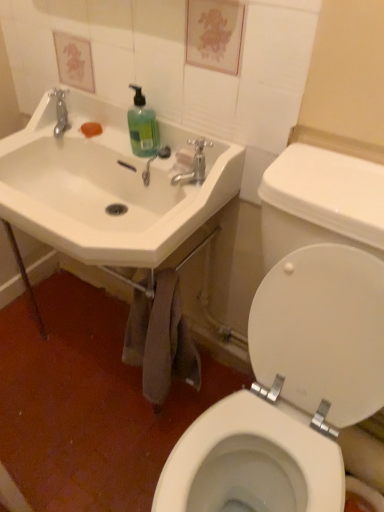
The width and height of the screenshot is (384, 512). I want to click on white ceramic sink at upper left, so [107, 187].

You are a GUI agent. You are given a task and a screenshot of the screen. Output one action in this format:
    pyautogui.click(x=<x>, y=<y>)
    Task: Click on the white glossy toilet lid at right
    The width and height of the screenshot is (384, 512).
    Given the screenshot: What is the action you would take?
    pyautogui.click(x=322, y=330)

Does point (197, 169) come behind point (166, 227)?

Yes.

Is matte silver faucet at upper center oriented towards white ceramic sink at upper left?

Yes, matte silver faucet at upper center is turned towards white ceramic sink at upper left.

Which of these two, matte silver faucet at upper center or white ceramic sink at upper left, is thinner?

Thinner between the two is matte silver faucet at upper center.

Is point (339, 325) farther from viewer compared to point (152, 160)?

No, (339, 325) is closer to viewer.

Considering the positions of objects white glossy toilet lid at right and translucent plastic faucet at upper center in the image provided, who is more to the left, white glossy toilet lid at right or translucent plastic faucet at upper center?

Positioned to the left is translucent plastic faucet at upper center.

Considering the sizes of objects white glossy toilet lid at right and translucent plastic faucet at upper center in the image provided, who is shorter, white glossy toilet lid at right or translucent plastic faucet at upper center?

Standing shorter between the two is translucent plastic faucet at upper center.

Is green matte liquid soap at upper center inside the boundaries of white glossy toilet lid at right, or outside?

green matte liquid soap at upper center lies outside white glossy toilet lid at right.

Does green matte liquid soap at upper center appear on the right side of white glossy toilet lid at right?

Incorrect, green matte liquid soap at upper center is not on the right side of white glossy toilet lid at right.

Is green matte liquid soap at upper center thinner than white glossy toilet lid at right?

No, green matte liquid soap at upper center is not thinner than white glossy toilet lid at right.

I want to click on cleaning product above the white glossy toilet lid at right (from a real-world perspective), so click(142, 126).

How far apart are white glossy toilet lid at right and matte silver faucet at upper center?

white glossy toilet lid at right and matte silver faucet at upper center are 18.10 inches apart.

Is white glossy toilet lid at right oriented away from matte silver faucet at upper center?

No, white glossy toilet lid at right's orientation is not away from matte silver faucet at upper center.

How many degrees apart are the facing directions of white glossy toilet lid at right and matte silver faucet at upper center?

The angular difference between white glossy toilet lid at right and matte silver faucet at upper center is 0.278 degrees.

Which object is positioned more to the left, white glossy toilet lid at right or matte silver faucet at upper center?

matte silver faucet at upper center.

Does white ceramic sink at upper left have a lesser width compared to matte silver faucet at upper center?

No, white ceramic sink at upper left is not thinner than matte silver faucet at upper center.

Would you say white ceramic sink at upper left is a long distance from matte silver faucet at upper center?

Actually, white ceramic sink at upper left and matte silver faucet at upper center are a little close together.

From the image's perspective, which is below, white ceramic sink at upper left or matte silver faucet at upper center?

From the image's view, white ceramic sink at upper left is below.

Which object is further away from the camera, white ceramic sink at upper left or green matte liquid soap at upper center?

green matte liquid soap at upper center is more distant.

Is white ceramic sink at upper left situated inside green matte liquid soap at upper center or outside?

white ceramic sink at upper left is located beyond the bounds of green matte liquid soap at upper center.

You are a GUI agent. You are given a task and a screenshot of the screen. Output one action in this format:
    pyautogui.click(x=<x>, y=<y>)
    Task: Click on the cleaning product located behind the white ceramic sink at upper left
    Image resolution: width=384 pixels, height=512 pixels.
    Given the screenshot: What is the action you would take?
    pyautogui.click(x=142, y=126)

From the image's perspective, is white ceramic sink at upper left on top of green matte liquid soap at upper center?

Incorrect, from the image's perspective, white ceramic sink at upper left is lower than green matte liquid soap at upper center.

Is green matte liquid soap at upper center a part of white glossy toilet lid at right?

No.

Considering the sizes of objects white glossy toilet lid at right and green matte liquid soap at upper center in the image provided, who is wider, white glossy toilet lid at right or green matte liquid soap at upper center?

green matte liquid soap at upper center is wider.

Could you tell me if white glossy toilet lid at right is turned towards green matte liquid soap at upper center?

No, white glossy toilet lid at right is not oriented towards green matte liquid soap at upper center.

Considering their positions, is white glossy toilet lid at right located in front of or behind green matte liquid soap at upper center?

Visually, white glossy toilet lid at right is located in front of green matte liquid soap at upper center.

There is a white ceramic sink at upper left. Where is `tap above it (from a real-world perspective)`? This screenshot has height=512, width=384. tap above it (from a real-world perspective) is located at coordinates (194, 163).

The width and height of the screenshot is (384, 512). I want to click on plumbing fixture that is above the white glossy toilet lid at right (from the image's perspective), so click(x=153, y=159).

Considering their positions, is green matte liquid soap at upper center positioned further to matte silver faucet at upper center than white ceramic sink at upper left?

white ceramic sink at upper left lies further to matte silver faucet at upper center than the other object.

Which object lies nearer to the anchor point white glossy toilet lid at right, white ceramic sink at upper left or green matte liquid soap at upper center?

white ceramic sink at upper left is positioned closer to the anchor white glossy toilet lid at right.

Which object lies nearer to the anchor point white ceramic sink at upper left, translucent plastic faucet at upper center or white glossy toilet lid at right?

translucent plastic faucet at upper center.

Based on their spatial positions, is matte silver faucet at upper center or translucent plastic faucet at upper center further from white ceramic sink at upper left?

matte silver faucet at upper center is positioned further to the anchor white ceramic sink at upper left.

Looking at this image, from the image, which object appears to be nearer to green matte liquid soap at upper center, matte silver faucet at upper center or translucent plastic faucet at upper center?

Based on the image, translucent plastic faucet at upper center appears to be nearer to green matte liquid soap at upper center.

Estimate the real-world distances between objects in this image. Which object is further from translucent plastic faucet at upper center, green matte liquid soap at upper center or white glossy toilet lid at right?

Based on the image, white glossy toilet lid at right appears to be further to translucent plastic faucet at upper center.

Looking at the image, which one is located closer to white glossy toilet lid at right, translucent plastic faucet at upper center or matte silver faucet at upper center?

matte silver faucet at upper center is positioned closer to the anchor white glossy toilet lid at right.

Looking at the image, which one is located closer to white glossy toilet lid at right, white ceramic sink at upper left or matte silver faucet at upper center?

white ceramic sink at upper left.

The width and height of the screenshot is (384, 512). What are the coordinates of `tap between green matte liquid soap at upper center and translucent plastic faucet at upper center vertically` in the screenshot? It's located at (194, 163).

Where is `tap between white ceramic sink at upper left and white glossy toilet lid at right`? The width and height of the screenshot is (384, 512). tap between white ceramic sink at upper left and white glossy toilet lid at right is located at coordinates (194, 163).

Locate an element on the screen. plumbing fixture between green matte liquid soap at upper center and white glossy toilet lid at right vertically is located at coordinates (153, 159).

Where is `tap located between white ceramic sink at upper left and translucent plastic faucet at upper center in the depth direction`? tap located between white ceramic sink at upper left and translucent plastic faucet at upper center in the depth direction is located at coordinates (194, 163).